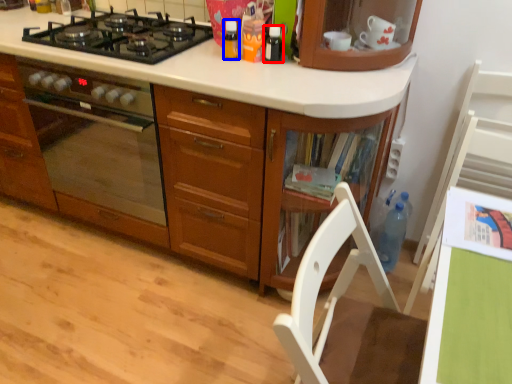
Question: Which object is closer to the camera taking this photo, kitchen appliance (highlighted by a red box) or kitchen appliance (highlighted by a blue box)?

Choices:
 (A) kitchen appliance
 (B) kitchen appliance

Answer: (A)